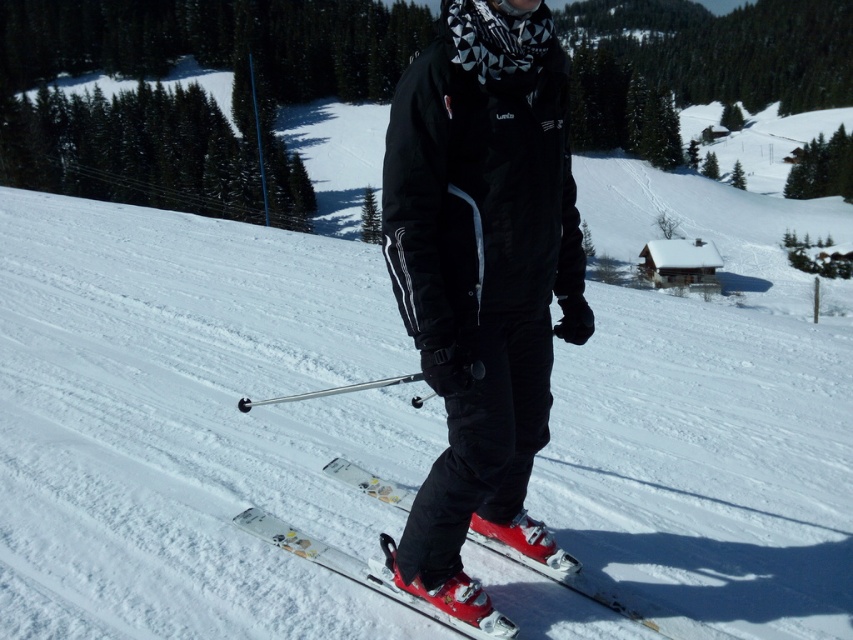
You are a skier planning to take a photo of the dense evergreen trees in the background. To ensure the trees are in focus, you need to position yourself so that the point at coordinates point [190,422] is within your camera frame. Where should you move relative to the white powder snow at center?

The point at coordinates point [190,422] is located on the white powder snow at center. To capture the dense evergreen trees in the background, you should move towards the background away from the white powder snow at center so the trees come into focus while keeping the point in your frame.

You are standing at the camera position and want to know how far the point at coordinates (509, 545) is from you. Can you determine the distance?

The point at coordinates (509, 545) is 12.70 feet away from the camera position.

You are a drone operator trying to capture the best aerial shot of the skier. The skier is currently at the bottom of the slope. To get a clear view of the skier, should you position the drone above or below the white powder snow at center?

The white powder snow at center is located at point (190, 422). Since the skier is at the bottom of the slope, positioning the drone above the white powder snow at center would provide a better view as it is higher up the slope.